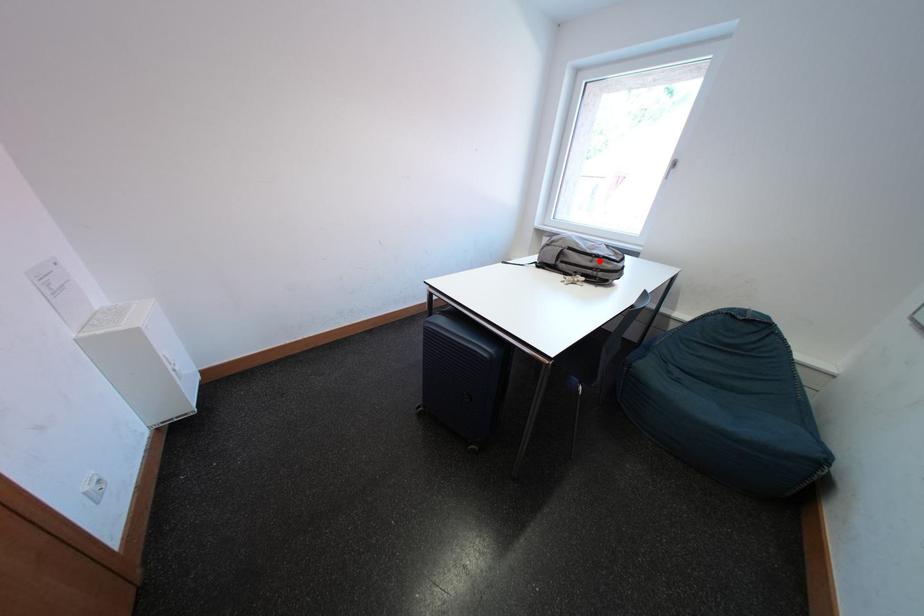
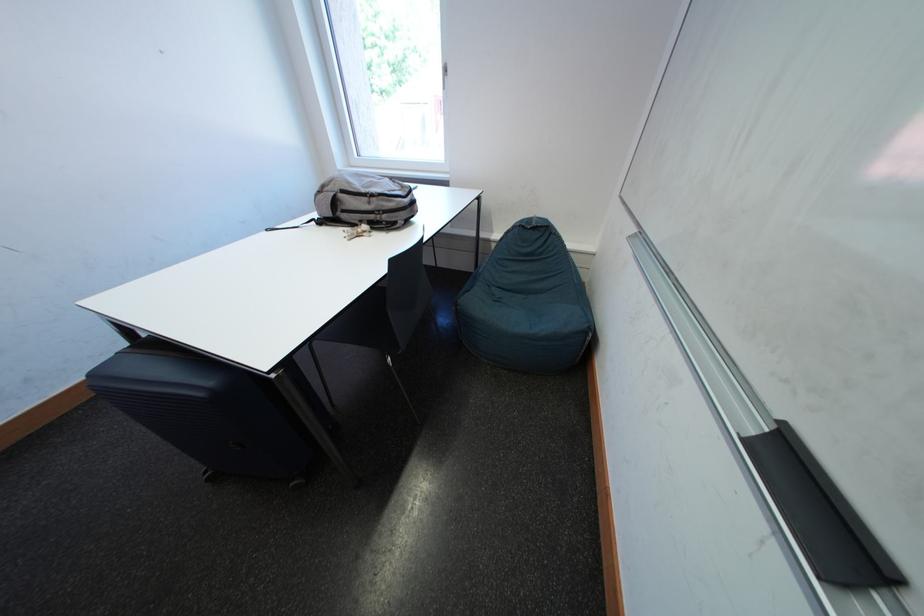
Locate, in the second image, the point that corresponds to the highlighted location in the first image.

(375, 203)